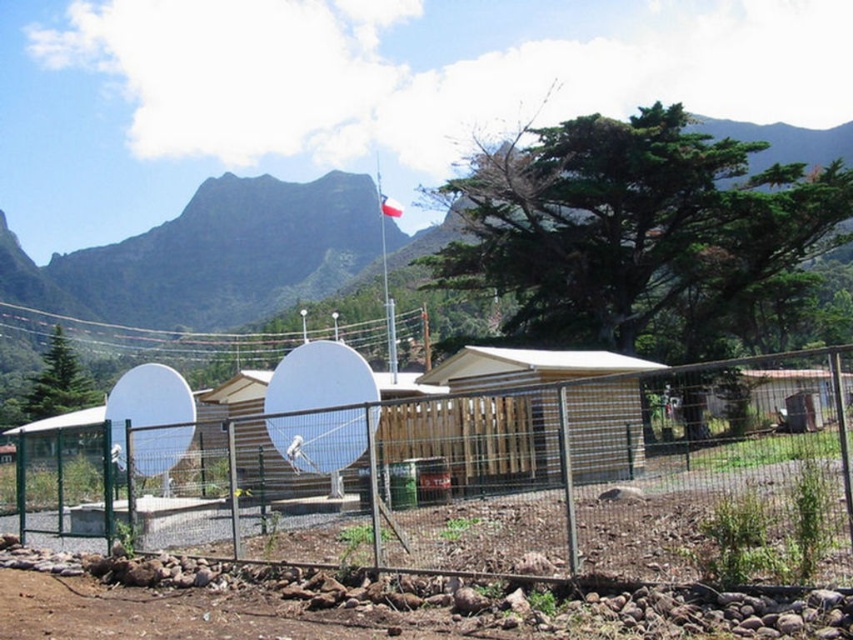
You are standing outside the fenced area and want to take a photo of the white plastic flagpole at center without the green wire mesh fence at center blocking the view. Is this possible based on their positions?

The green wire mesh fence at center is closer to the viewer than the white plastic flagpole at center, so the fence would block the view of the flagpole. Therefore, you cannot take a photo of the white plastic flagpole at center without the green wire mesh fence at center blocking the view.

You are a photographer planning to capture a landscape shot of the green grassy mountain at upper center and the white plastic flagpole at center. Which object will occupy more horizontal space in your photo?

The green grassy mountain at upper center will occupy more horizontal space in the photo because its width surpasses that of the white plastic flagpole at center.